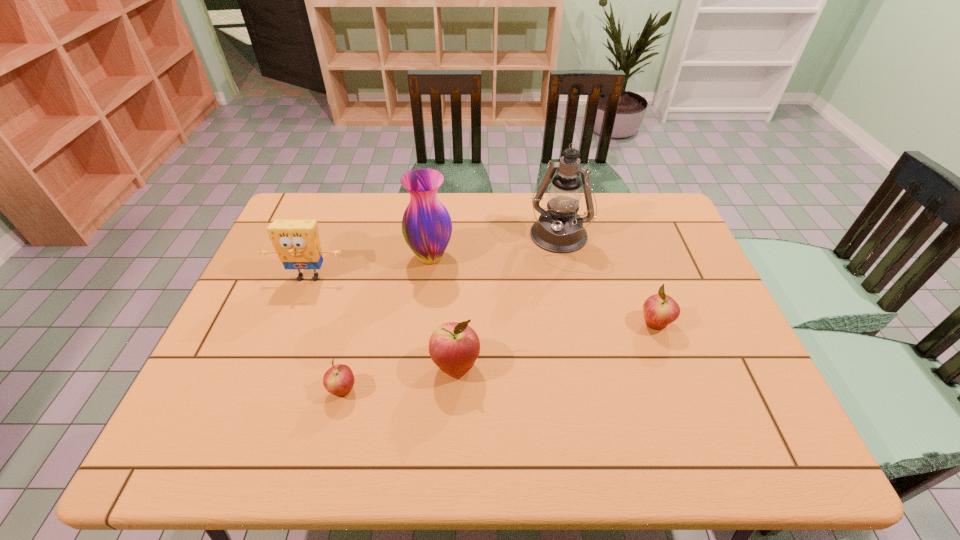
This screenshot has height=540, width=960. I want to click on vacant region between the farthest apple and the fifth shortest object, so click(542, 290).

Locate which object ranks in proximity to the tallest apple. Please provide its 2D coordinates. Your answer should be formatted as a tuple, i.e. [(x, y)], where the tuple contains the x and y coordinates of a point satisfying the conditions above.

[(339, 379)]

Choose which object is the fifth nearest neighbor to the fifth object from left to right. Please provide its 2D coordinates. Your answer should be formatted as a tuple, i.e. [(x, y)], where the tuple contains the x and y coordinates of a point satisfying the conditions above.

[(339, 379)]

Locate which apple ranks third in proximity to the second object from right to left. Please provide its 2D coordinates. Your answer should be formatted as a tuple, i.e. [(x, y)], where the tuple contains the x and y coordinates of a point satisfying the conditions above.

[(339, 379)]

Locate which apple ranks in proximity to the rightmost object. Please provide its 2D coordinates. Your answer should be formatted as a tuple, i.e. [(x, y)], where the tuple contains the x and y coordinates of a point satisfying the conditions above.

[(454, 347)]

Find the location of `vacant space that satisfies the following two spatial constraints: 1. on the face of the leftmost object; 2. on the right side of the leftmost apple`. vacant space that satisfies the following two spatial constraints: 1. on the face of the leftmost object; 2. on the right side of the leftmost apple is located at coordinates (265, 390).

Locate an element on the screen. Image resolution: width=960 pixels, height=540 pixels. vacant area that satisfies the following two spatial constraints: 1. on the face of the second shortest object; 2. on the right side of the sponge is located at coordinates (291, 323).

Locate an element on the screen. The width and height of the screenshot is (960, 540). free point that satisfies the following two spatial constraints: 1. on the back side of the farthest apple; 2. on the right side of the tallest apple is located at coordinates (458, 323).

Locate an element on the screen. vacant space that satisfies the following two spatial constraints: 1. on the face of the tallest apple; 2. on the left side of the leftmost object is located at coordinates (275, 366).

Locate an element on the screen. free location that satisfies the following two spatial constraints: 1. on the face of the shortest object; 2. on the left side of the leftmost object is located at coordinates (x=265, y=390).